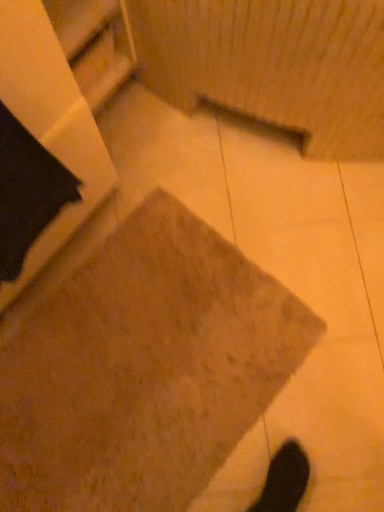
What do you see at coordinates (95, 45) in the screenshot? I see `wooden shelf at upper left` at bounding box center [95, 45].

Find the location of `wooden shelf at upper left`. wooden shelf at upper left is located at coordinates click(95, 45).

The width and height of the screenshot is (384, 512). What do you see at coordinates (144, 369) in the screenshot?
I see `brown textured concrete at center` at bounding box center [144, 369].

Locate an element on the screen. The width and height of the screenshot is (384, 512). brown textured concrete at center is located at coordinates coord(144,369).

This screenshot has height=512, width=384. In order to click on wooden shelf at upper left in this screenshot , I will do `click(95, 45)`.

Visually, is wooden shelf at upper left positioned to the left or to the right of brown textured concrete at center?

From the image, it's evident that wooden shelf at upper left is to the left of brown textured concrete at center.

Consider the image. Which is in front, wooden shelf at upper left or brown textured concrete at center?

wooden shelf at upper left is more forward.

Considering the positions of point (107, 42) and point (69, 362), is point (107, 42) closer or farther from the camera than point (69, 362)?

Point (107, 42) appears to be closer to the viewer than point (69, 362).

From the image's perspective, is wooden shelf at upper left positioned above or below brown textured concrete at center?

Clearly, from the image's perspective, wooden shelf at upper left is above brown textured concrete at center.

From a real-world perspective, is wooden shelf at upper left positioned over brown textured concrete at center based on gravity?

Yes, from a real-world perspective, wooden shelf at upper left is on top of brown textured concrete at center.

Looking at this image, is wooden shelf at upper left wider than brown textured concrete at center?

In fact, wooden shelf at upper left might be narrower than brown textured concrete at center.

Between wooden shelf at upper left and brown textured concrete at center, which one has less height?

Standing shorter between the two is brown textured concrete at center.

Can you confirm if wooden shelf at upper left is smaller than brown textured concrete at center?

Incorrect, wooden shelf at upper left is not smaller in size than brown textured concrete at center.

Looking at this image, would you say wooden shelf at upper left contains brown textured concrete at center?

No, wooden shelf at upper left does not contain brown textured concrete at center.

Are wooden shelf at upper left and brown textured concrete at center located far from each other?

No, wooden shelf at upper left is not far away from brown textured concrete at center.

Could you tell me if wooden shelf at upper left is facing brown textured concrete at center?

No, wooden shelf at upper left is not oriented towards brown textured concrete at center.

How many degrees apart are the facing directions of wooden shelf at upper left and brown textured concrete at center?

wooden shelf at upper left and brown textured concrete at center are facing 93.9 degrees away from each other.

What are the coordinates of `concrete behind the wooden shelf at upper left` in the screenshot? It's located at (144, 369).

Considering the relative positions of brown textured concrete at center and wooden shelf at upper left in the image provided, is brown textured concrete at center to the right of wooden shelf at upper left from the viewer's perspective?

Yes.

Which object is more forward, brown textured concrete at center or wooden shelf at upper left?

wooden shelf at upper left is in front.

Which is less distant, (41, 342) or (108, 4)?

Point (108, 4)

From the image's perspective, is brown textured concrete at center above or below wooden shelf at upper left?

Clearly, from the image's perspective, brown textured concrete at center is below wooden shelf at upper left.

From a real-world perspective, is brown textured concrete at center physically located above or below wooden shelf at upper left?

Clearly, from a real-world perspective, brown textured concrete at center is below wooden shelf at upper left.

Is brown textured concrete at center wider or thinner than wooden shelf at upper left?

brown textured concrete at center is wider than wooden shelf at upper left.

Which of these two, brown textured concrete at center or wooden shelf at upper left, stands taller?

With more height is wooden shelf at upper left.

Considering the sizes of objects brown textured concrete at center and wooden shelf at upper left in the image provided, who is smaller, brown textured concrete at center or wooden shelf at upper left?

brown textured concrete at center is smaller.

Can wooden shelf at upper left be found inside brown textured concrete at center?

That's incorrect, wooden shelf at upper left is not inside brown textured concrete at center.

From the picture: Can you see brown textured concrete at center touching wooden shelf at upper left?

No, brown textured concrete at center is not next to wooden shelf at upper left.

Consider the image. Is wooden shelf at upper left at the back of brown textured concrete at center?

No, brown textured concrete at center is not facing the opposite direction of wooden shelf at upper left.

What's the angular difference between brown textured concrete at center and wooden shelf at upper left's facing directions?

93.9 degrees separate the facing orientations of brown textured concrete at center and wooden shelf at upper left.

You are a GUI agent. You are given a task and a screenshot of the screen. Output one action in this format:
    pyautogui.click(x=<x>, y=<y>)
    Task: Click on the concrete that is behind the wooden shelf at upper left
    The width and height of the screenshot is (384, 512).
    Given the screenshot: What is the action you would take?
    pos(144,369)

There is a brown textured concrete at center. Where is `shelf above it (from a real-world perspective)`? shelf above it (from a real-world perspective) is located at coordinates (95, 45).

Locate an element on the screen. Image resolution: width=384 pixels, height=512 pixels. shelf located above the brown textured concrete at center (from the image's perspective) is located at coordinates (95, 45).